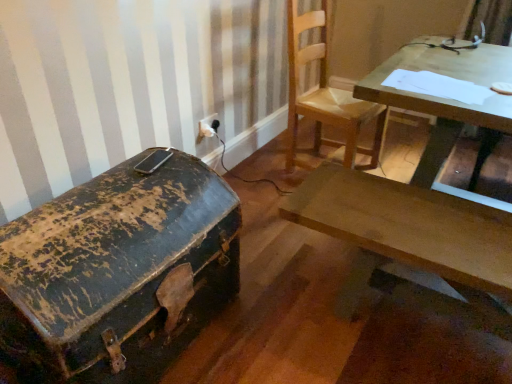
Question: Does wooden chair at upper center have a greater width compared to wooden table at upper right?

Choices:
 (A) no
 (B) yes

Answer: (A)

Question: Can you confirm if wooden chair at upper center is positioned to the right of wooden table at upper right?

Choices:
 (A) no
 (B) yes

Answer: (A)

Question: Is wooden chair at upper center bigger than wooden table at upper right?

Choices:
 (A) no
 (B) yes

Answer: (A)

Question: Considering the relative positions of wooden chair at upper center and wooden table at upper right in the image provided, is wooden chair at upper center to the left of wooden table at upper right from the viewer's perspective?

Choices:
 (A) no
 (B) yes

Answer: (B)

Question: Is wooden chair at upper center located outside wooden table at upper right?

Choices:
 (A) no
 (B) yes

Answer: (B)

Question: Is wooden chair at upper center oriented towards wooden table at upper right?

Choices:
 (A) no
 (B) yes

Answer: (B)

Question: Is wooden chair at upper center behind wooden desk at center?

Choices:
 (A) yes
 (B) no

Answer: (A)

Question: From a real-world perspective, is wooden chair at upper center beneath wooden desk at center?

Choices:
 (A) yes
 (B) no

Answer: (B)

Question: Is wooden chair at upper center shorter than wooden desk at center?

Choices:
 (A) no
 (B) yes

Answer: (A)

Question: Is wooden chair at upper center far from wooden desk at center?

Choices:
 (A) no
 (B) yes

Answer: (A)

Question: Does wooden chair at upper center have a larger size compared to wooden desk at center?

Choices:
 (A) yes
 (B) no

Answer: (A)

Question: From the image's perspective, is wooden chair at upper center on top of wooden desk at center?

Choices:
 (A) yes
 (B) no

Answer: (A)

Question: Considering the relative sizes of white plastic electric outlet at upper center and wooden table at upper right in the image provided, is white plastic electric outlet at upper center thinner than wooden table at upper right?

Choices:
 (A) yes
 (B) no

Answer: (A)